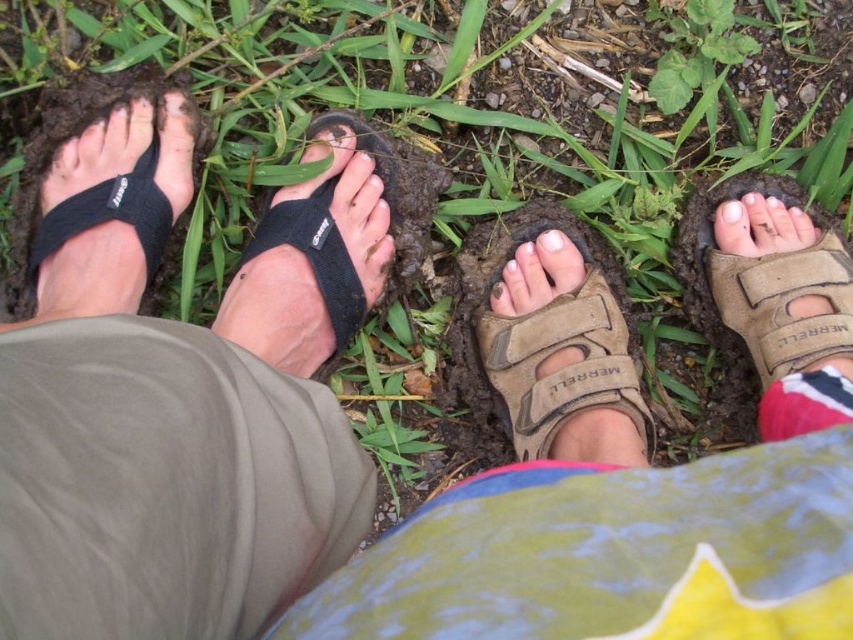
Looking at this image, you are a photographer setting up a shoot focusing on footwear details. You need to ensure that the tan suede sandal at right and the white matte nail at center are both visible in the frame. Based on their heights, which object will appear larger in the photo?

The tan suede sandal at right is taller than the white matte nail at center, so it will appear larger in the photo.

You are a photographer trying to capture a closeup of the matte brown sandal at lower right without the black fabric sandal at lower left blocking it. Based on their positions, can you adjust your camera angle to avoid the obstruction?

The black fabric sandal at lower left is in front of the matte brown sandal at lower right, so you can lower your camera angle to capture the matte brown sandal at lower right without obstruction from the black fabric sandal at lower left.